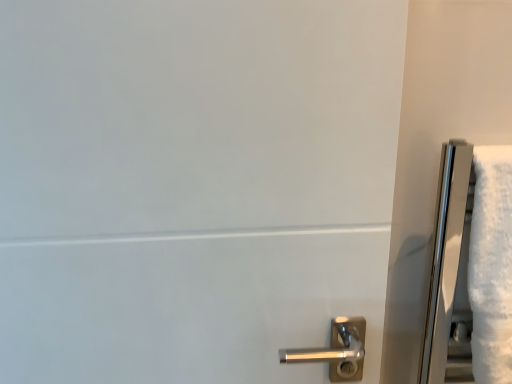
Describe the element at coordinates (446, 254) in the screenshot. This screenshot has height=384, width=512. I see `polished chrome towel rack at right` at that location.

You are a GUI agent. You are given a task and a screenshot of the screen. Output one action in this format:
    pyautogui.click(x=<x>, y=<y>)
    Task: Click on the polished chrome towel rack at right
    The image size is (512, 384).
    Given the screenshot: What is the action you would take?
    pyautogui.click(x=446, y=254)

In order to face polished chrome towel rack at right, should I rotate leftwards or rightwards?

To face it directly, rotate right by 30.722 degrees.

What is the approximate width of polished chrome towel rack at right?

polished chrome towel rack at right is 5.26 inches in width.

The height and width of the screenshot is (384, 512). Find the location of `polished chrome towel rack at right`. polished chrome towel rack at right is located at coordinates (446, 254).